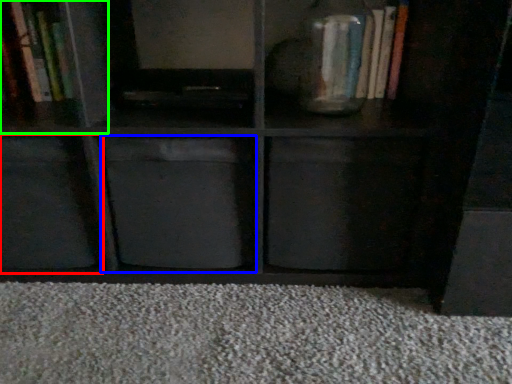
Question: Considering the real-world distances, which object is closest to cabinet (highlighted by a red box)? cabinet (highlighted by a blue box) or cabinet (highlighted by a green box).

Choices:
 (A) cabinet
 (B) cabinet

Answer: (A)